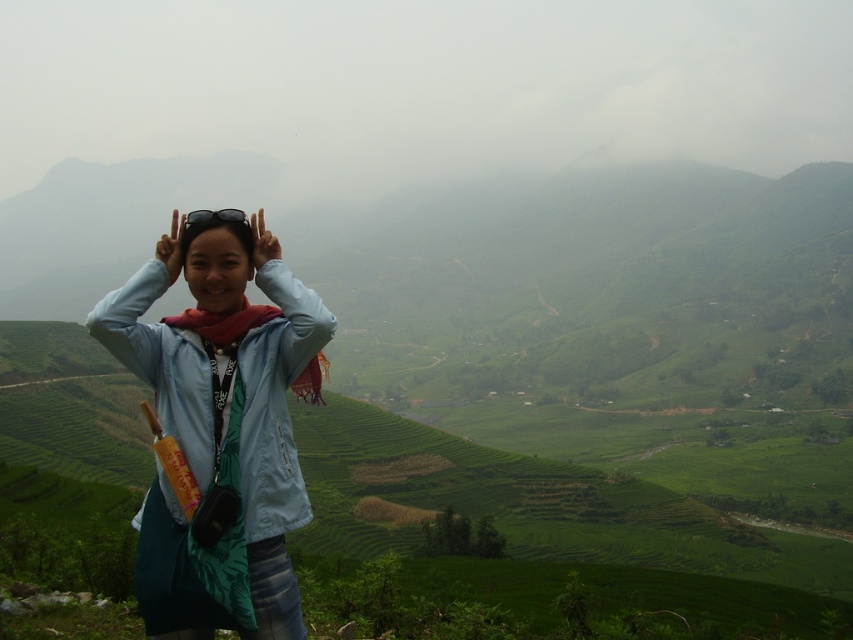
Between light blue fabric jacket at center and matte blue head at center, which one appears on the right side from the viewer's perspective?

Positioned to the right is light blue fabric jacket at center.

How far apart are light blue fabric jacket at center and matte blue head at center?

light blue fabric jacket at center and matte blue head at center are 2.23 meters apart from each other.

This screenshot has height=640, width=853. What do you see at coordinates (222, 428) in the screenshot?
I see `light blue fabric jacket at center` at bounding box center [222, 428].

Identify the location of light blue fabric jacket at center. (222, 428).